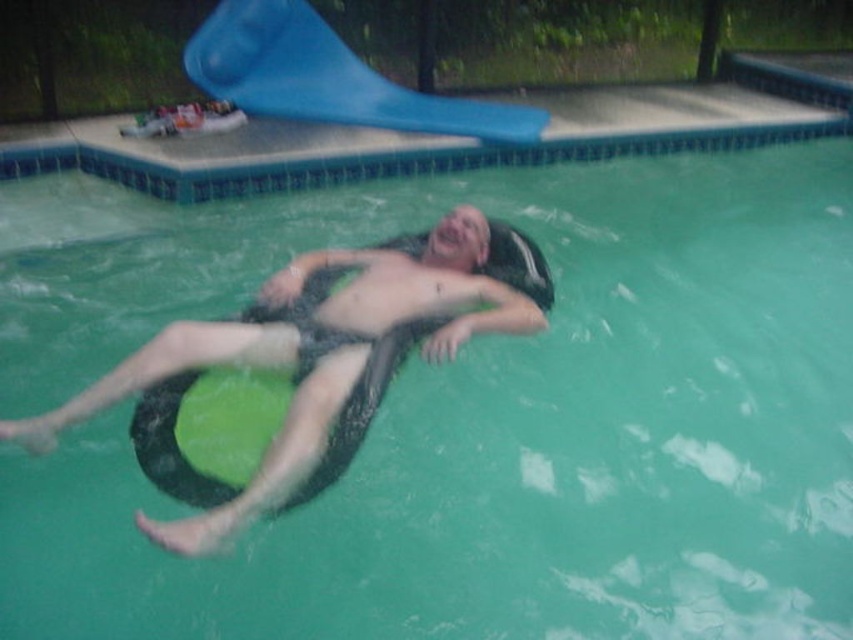
Question: Is black rubber tube at center further to camera compared to blue rubber slide at upper center?

Choices:
 (A) no
 (B) yes

Answer: (A)

Question: Which point is closer to the camera?

Choices:
 (A) [x=532, y=124]
 (B) [x=158, y=481]

Answer: (B)

Question: Does black rubber tube at center appear on the left side of blue rubber slide at upper center?

Choices:
 (A) no
 (B) yes

Answer: (A)

Question: Does black rubber tube at center have a lesser width compared to blue rubber slide at upper center?

Choices:
 (A) no
 (B) yes

Answer: (B)